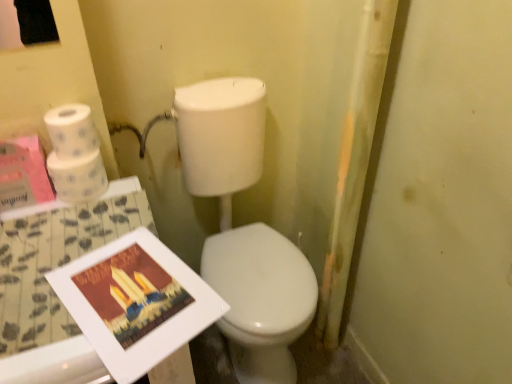
The image size is (512, 384). What do you see at coordinates (136, 302) in the screenshot? I see `matte paper magazine at lower left` at bounding box center [136, 302].

In order to face white matte toilet paper at upper left, which is counted as the second toilet paper, starting from the bottom, should I rotate leftwards or rightwards?

You should rotate left by 23.233 degrees.

Measure the distance between white matte toilet paper at upper left, marked as the first toilet paper in a top-to-bottom arrangement, and camera.

They are 91.84 centimeters apart.

Describe the element at coordinates (78, 177) in the screenshot. I see `white matte toilet paper at upper left, arranged as the 2th toilet paper when viewed from the top` at that location.

Identify the location of matte paper magazine at lower left. This screenshot has width=512, height=384. (136, 302).

Is white glossy toilet at center oriented away from white matte toilet paper at upper left, arranged as the 2th toilet paper when viewed from the top?

No, white glossy toilet at center is not facing the opposite direction of white matte toilet paper at upper left, arranged as the 2th toilet paper when viewed from the top.

Looking at the image, does white glossy toilet at center seem bigger or smaller compared to white matte toilet paper at upper left, arranged as the 2th toilet paper when viewed from the top?

Clearly, white glossy toilet at center is larger in size than white matte toilet paper at upper left, arranged as the 2th toilet paper when viewed from the top.

Can you tell me how much white glossy toilet at center and white matte toilet paper at upper left, the 1th toilet paper positioned from the bottom, differ in facing direction?

white glossy toilet at center and white matte toilet paper at upper left, the 1th toilet paper positioned from the bottom, are facing 0.621 degrees away from each other.

Would you say white glossy toilet at center is outside white matte toilet paper at upper left, arranged as the 2th toilet paper when viewed from the top?

That's correct, white glossy toilet at center is outside of white matte toilet paper at upper left, arranged as the 2th toilet paper when viewed from the top.

Considering the sizes of objects white matte toilet paper at upper left, arranged as the 2th toilet paper when viewed from the top, and matte paper magazine at lower left in the image provided, who is bigger, white matte toilet paper at upper left, arranged as the 2th toilet paper when viewed from the top, or matte paper magazine at lower left?

white matte toilet paper at upper left, arranged as the 2th toilet paper when viewed from the top.

From the image's perspective, which object appears higher, white matte toilet paper at upper left, the 1th toilet paper positioned from the bottom, or matte paper magazine at lower left?

white matte toilet paper at upper left, the 1th toilet paper positioned from the bottom, from the image's perspective.

Consider the image. From a real-world perspective, is white matte toilet paper at upper left, the 1th toilet paper positioned from the bottom, positioned above or below matte paper magazine at lower left?

From a real-world perspective, white matte toilet paper at upper left, the 1th toilet paper positioned from the bottom, is physically above matte paper magazine at lower left.

Would you say white matte toilet paper at upper left, arranged as the 2th toilet paper when viewed from the top, is outside matte paper magazine at lower left?

Yes, white matte toilet paper at upper left, arranged as the 2th toilet paper when viewed from the top, is not within matte paper magazine at lower left.

From a real-world perspective, which is physically above, white matte toilet paper at upper left, which is counted as the second toilet paper, starting from the bottom, or white glossy toilet at center?

In real-world perspective, white matte toilet paper at upper left, which is counted as the second toilet paper, starting from the bottom, is above.

In the scene shown: Would you say white matte toilet paper at upper left, marked as the first toilet paper in a top-to-bottom arrangement, is inside or outside white glossy toilet at center?

white matte toilet paper at upper left, marked as the first toilet paper in a top-to-bottom arrangement, is spatially situated outside white glossy toilet at center.

Between white matte toilet paper at upper left, which is counted as the second toilet paper, starting from the bottom, and white glossy toilet at center, which one appears on the right side from the viewer's perspective?

From the viewer's perspective, white glossy toilet at center appears more on the right side.

Image resolution: width=512 pixels, height=384 pixels. In order to click on toiletries below the white matte toilet paper at upper left, which is counted as the second toilet paper, starting from the bottom (from a real-world perspective) in this screenshot , I will do `click(244, 229)`.

What's the angular difference between white matte toilet paper at upper left, which is counted as the second toilet paper, starting from the bottom, and matte paper magazine at lower left's facing directions?

white matte toilet paper at upper left, which is counted as the second toilet paper, starting from the bottom, and matte paper magazine at lower left are facing 19.2 degrees away from each other.

From a real-world perspective, is white matte toilet paper at upper left, which is counted as the second toilet paper, starting from the bottom, positioned above or below matte paper magazine at lower left?

white matte toilet paper at upper left, which is counted as the second toilet paper, starting from the bottom, is above matte paper magazine at lower left.

Between white matte toilet paper at upper left, marked as the first toilet paper in a top-to-bottom arrangement, and matte paper magazine at lower left, which one has smaller width?

With smaller width is white matte toilet paper at upper left, marked as the first toilet paper in a top-to-bottom arrangement.

Considering the relative sizes of white matte toilet paper at upper left, which is counted as the second toilet paper, starting from the bottom, and matte paper magazine at lower left in the image provided, is white matte toilet paper at upper left, which is counted as the second toilet paper, starting from the bottom, taller than matte paper magazine at lower left?

Correct, white matte toilet paper at upper left, which is counted as the second toilet paper, starting from the bottom, is much taller as matte paper magazine at lower left.

From the image's perspective, does white matte toilet paper at upper left, marked as the first toilet paper in a top-to-bottom arrangement, appear lower than white matte toilet paper at upper left, the 1th toilet paper positioned from the bottom?

No, from the image's perspective, white matte toilet paper at upper left, marked as the first toilet paper in a top-to-bottom arrangement, is not beneath white matte toilet paper at upper left, the 1th toilet paper positioned from the bottom.

Is white matte toilet paper at upper left, which is counted as the second toilet paper, starting from the bottom, facing away from white matte toilet paper at upper left, the 1th toilet paper positioned from the bottom?

No, white matte toilet paper at upper left, which is counted as the second toilet paper, starting from the bottom,'s orientation is not away from white matte toilet paper at upper left, the 1th toilet paper positioned from the bottom.

Considering the relative positions of white matte toilet paper at upper left, marked as the first toilet paper in a top-to-bottom arrangement, and white matte toilet paper at upper left, the 1th toilet paper positioned from the bottom, in the image provided, is white matte toilet paper at upper left, marked as the first toilet paper in a top-to-bottom arrangement, to the left of white matte toilet paper at upper left, the 1th toilet paper positioned from the bottom, from the viewer's perspective?

No, white matte toilet paper at upper left, marked as the first toilet paper in a top-to-bottom arrangement, is not to the left of white matte toilet paper at upper left, the 1th toilet paper positioned from the bottom.

Is white matte toilet paper at upper left, marked as the first toilet paper in a top-to-bottom arrangement, spatially inside white matte toilet paper at upper left, the 1th toilet paper positioned from the bottom, or outside of it?

white matte toilet paper at upper left, marked as the first toilet paper in a top-to-bottom arrangement, is not enclosed by white matte toilet paper at upper left, the 1th toilet paper positioned from the bottom.

Consider the image. Is white glossy toilet at center not inside matte paper magazine at lower left?

Yes.

Find the location of `toiletries on the right of the matte paper magazine at lower left`. toiletries on the right of the matte paper magazine at lower left is located at coordinates pos(244,229).

Is white glossy toilet at center positioned before matte paper magazine at lower left?

No, white glossy toilet at center is further to the viewer.

Is matte paper magazine at lower left behind white matte toilet paper at upper left, marked as the first toilet paper in a top-to-bottom arrangement?

That is False.

Is matte paper magazine at lower left turned away from white matte toilet paper at upper left, marked as the first toilet paper in a top-to-bottom arrangement?

No, white matte toilet paper at upper left, marked as the first toilet paper in a top-to-bottom arrangement, is not at the back of matte paper magazine at lower left.

Based on the photo, is matte paper magazine at lower left not near white matte toilet paper at upper left, marked as the first toilet paper in a top-to-bottom arrangement?

matte paper magazine at lower left is actually quite close to white matte toilet paper at upper left, marked as the first toilet paper in a top-to-bottom arrangement.

Between matte paper magazine at lower left and white matte toilet paper at upper left, marked as the first toilet paper in a top-to-bottom arrangement, which one appears on the right side from the viewer's perspective?

matte paper magazine at lower left is more to the right.

I want to click on the 2nd toilet paper behind when counting from the white glossy toilet at center, so click(x=78, y=177).

Locate an element on the screen. magazine in front of the white matte toilet paper at upper left, arranged as the 2th toilet paper when viewed from the top is located at coordinates (136, 302).

From the image, which object appears to be farther from matte paper magazine at lower left, white matte toilet paper at upper left, marked as the first toilet paper in a top-to-bottom arrangement, or white glossy toilet at center?

white glossy toilet at center is further to matte paper magazine at lower left.

Which object lies further to the anchor point matte paper magazine at lower left, white matte toilet paper at upper left, arranged as the 2th toilet paper when viewed from the top, or white glossy table at lower left?

Based on the image, white matte toilet paper at upper left, arranged as the 2th toilet paper when viewed from the top, appears to be further to matte paper magazine at lower left.

Looking at the image, which one is located further to white matte toilet paper at upper left, arranged as the 2th toilet paper when viewed from the top, white glossy table at lower left or matte paper magazine at lower left?

matte paper magazine at lower left is further to white matte toilet paper at upper left, arranged as the 2th toilet paper when viewed from the top.

Based on their spatial positions, is white matte toilet paper at upper left, marked as the first toilet paper in a top-to-bottom arrangement, or matte paper magazine at lower left further from white glossy toilet at center?

white matte toilet paper at upper left, marked as the first toilet paper in a top-to-bottom arrangement.

When comparing their distances from white matte toilet paper at upper left, the 1th toilet paper positioned from the bottom, does white glossy table at lower left or white glossy toilet at center seem closer?

Among the two, white glossy table at lower left is located nearer to white matte toilet paper at upper left, the 1th toilet paper positioned from the bottom.

When comparing their distances from white glossy table at lower left, does white matte toilet paper at upper left, arranged as the 2th toilet paper when viewed from the top, or white glossy toilet at center seem closer?

Based on the image, white matte toilet paper at upper left, arranged as the 2th toilet paper when viewed from the top, appears to be nearer to white glossy table at lower left.

From the picture: Looking at the image, which one is located closer to white matte toilet paper at upper left, marked as the first toilet paper in a top-to-bottom arrangement, matte paper magazine at lower left or white matte toilet paper at upper left, the 1th toilet paper positioned from the bottom?

Among the two, white matte toilet paper at upper left, the 1th toilet paper positioned from the bottom, is located nearer to white matte toilet paper at upper left, marked as the first toilet paper in a top-to-bottom arrangement.

Which object lies further to the anchor point white matte toilet paper at upper left, arranged as the 2th toilet paper when viewed from the top, white glossy toilet at center or white glossy table at lower left?

white glossy toilet at center lies further to white matte toilet paper at upper left, arranged as the 2th toilet paper when viewed from the top, than the other object.

Where is `magazine between white matte toilet paper at upper left, marked as the first toilet paper in a top-to-bottom arrangement, and white glossy table at lower left, in the vertical direction`? Image resolution: width=512 pixels, height=384 pixels. magazine between white matte toilet paper at upper left, marked as the first toilet paper in a top-to-bottom arrangement, and white glossy table at lower left, in the vertical direction is located at coordinates pos(136,302).

The image size is (512, 384). I want to click on magazine between white glossy table at lower left and white glossy toilet at center from left to right, so click(136, 302).

At what (x,y) coordinates should I click in order to perform the action: click on toilet paper between white matte toilet paper at upper left, which is counted as the second toilet paper, starting from the bottom, and white glossy table at lower left, in the vertical direction. Please return your answer as a coordinate pair (x, y). The image size is (512, 384). Looking at the image, I should click on (78, 177).

The width and height of the screenshot is (512, 384). What are the coordinates of `magazine between white matte toilet paper at upper left, the 1th toilet paper positioned from the bottom, and white glossy toilet at center` in the screenshot? It's located at (136, 302).